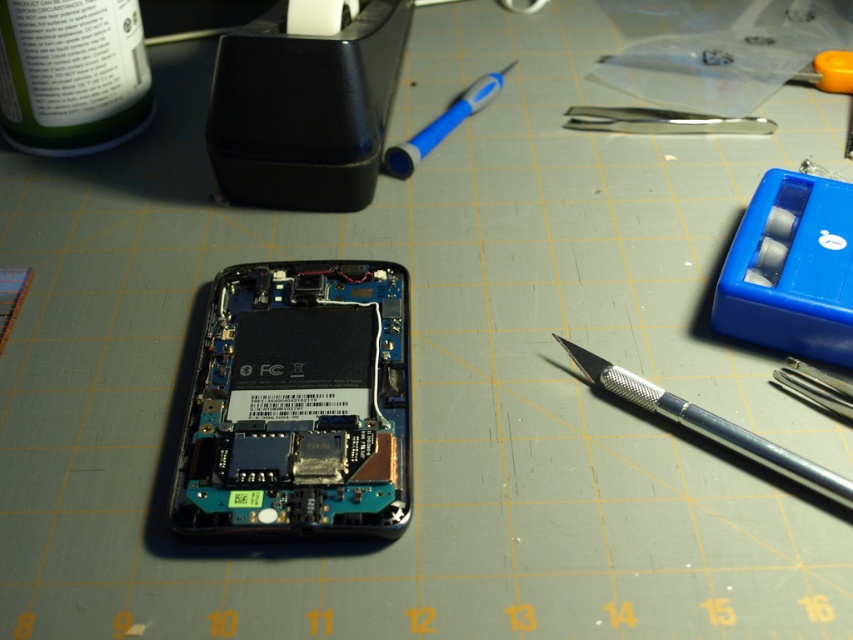
Does silver metallic knife at right appear on the right side of blue plastic pen at upper center?

Indeed, silver metallic knife at right is positioned on the right side of blue plastic pen at upper center.

Identify the location of silver metallic knife at right. The image size is (853, 640). (708, 424).

Is point (810, 481) positioned behind point (483, 81)?

No, it is in front of (483, 81).

Locate an element on the screen. silver metallic knife at right is located at coordinates (708, 424).

Who is shorter, green matte bottle at upper left or blue plastic pen at upper center?

With less height is green matte bottle at upper left.

Consider the image. Between green matte bottle at upper left and blue plastic pen at upper center, which one appears on the left side from the viewer's perspective?

green matte bottle at upper left

In the scene shown: Who is more forward, (82,72) or (500,84)?

Positioned in front is point (82,72).

You are a GUI agent. You are given a task and a screenshot of the screen. Output one action in this format:
    pyautogui.click(x=<x>, y=<y>)
    Task: Click on the green matte bottle at upper left
    
    Given the screenshot: What is the action you would take?
    pyautogui.click(x=71, y=74)

Is green matte bottle at upper left below silver metallic knife at right?

Actually, green matte bottle at upper left is above silver metallic knife at right.

Does green matte bottle at upper left lie behind silver metallic knife at right?

Yes, it is behind silver metallic knife at right.

In order to click on green matte bottle at upper left in this screenshot , I will do `click(71, 74)`.